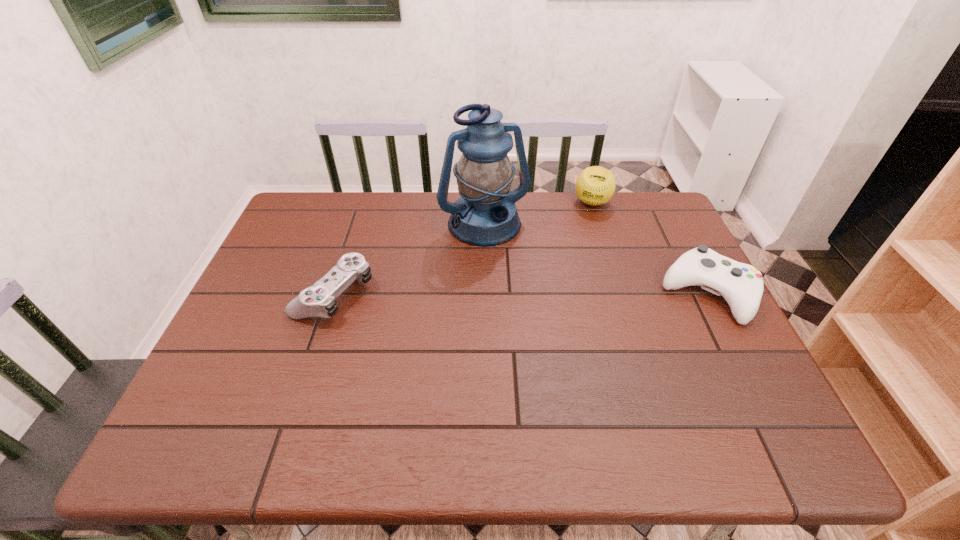
I want to click on vacant area at the left edge, so click(316, 253).

In the image, there is a desktop. Where is `free space at the right edge`? free space at the right edge is located at coordinates (662, 280).

Find the location of a particular element. This screenshot has height=540, width=960. vacant space at the far left corner is located at coordinates (324, 194).

The height and width of the screenshot is (540, 960). Identify the location of free space at the far right corner. (665, 202).

The height and width of the screenshot is (540, 960). Find the location of `vacant area that lies between the tallest object and the left control`. vacant area that lies between the tallest object and the left control is located at coordinates coord(409,260).

Where is `free space between the leftmost object and the softball`? Image resolution: width=960 pixels, height=540 pixels. free space between the leftmost object and the softball is located at coordinates (463, 248).

At what (x,y) coordinates should I click in order to perform the action: click on free spot between the left control and the right control. Please return your answer as a coordinate pair (x, y). This screenshot has height=540, width=960. Looking at the image, I should click on (521, 293).

Where is `free area in between the leftmost object and the rightmost object`? The height and width of the screenshot is (540, 960). free area in between the leftmost object and the rightmost object is located at coordinates (521, 293).

I want to click on vacant space that is in between the lantern and the softball, so click(539, 214).

You are a GUI agent. You are given a task and a screenshot of the screen. Output one action in this format:
    pyautogui.click(x=<x>, y=<y>)
    Task: Click on the free space between the third object from right to left and the right control
    The height and width of the screenshot is (540, 960).
    Given the screenshot: What is the action you would take?
    pyautogui.click(x=596, y=260)